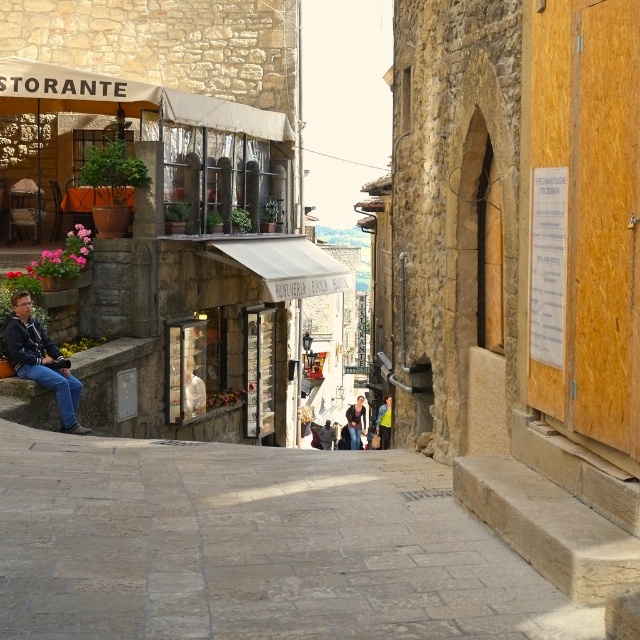
Question: Does gray stone alley at center appear on the left side of yellow-green shirt at center?

Choices:
 (A) yes
 (B) no

Answer: (A)

Question: Estimate the real-world distances between objects in this image. Which object is closer to the gray stone alley at center?

Choices:
 (A) yellow-green shirt at center
 (B) dark blue jeans at center
 (C) denim jacket at center
 (D) dark blue denim jacket at lower left

Answer: (D)

Question: Does yellow-green shirt at center lie behind dark blue jeans at center?

Choices:
 (A) yes
 (B) no

Answer: (B)

Question: Estimate the real-world distances between objects in this image. Which object is closer to the dark blue denim jacket at lower left?

Choices:
 (A) denim jacket at center
 (B) yellow-green shirt at center
 (C) dark blue jeans at center

Answer: (B)

Question: Is gray stone alley at center bigger than dark blue jeans at center?

Choices:
 (A) yes
 (B) no

Answer: (A)

Question: Estimate the real-world distances between objects in this image. Which object is farther from the dark blue denim jacket at lower left?

Choices:
 (A) denim jacket at center
 (B) dark blue jeans at center
 (C) yellow-green shirt at center
 (D) gray stone alley at center

Answer: (B)